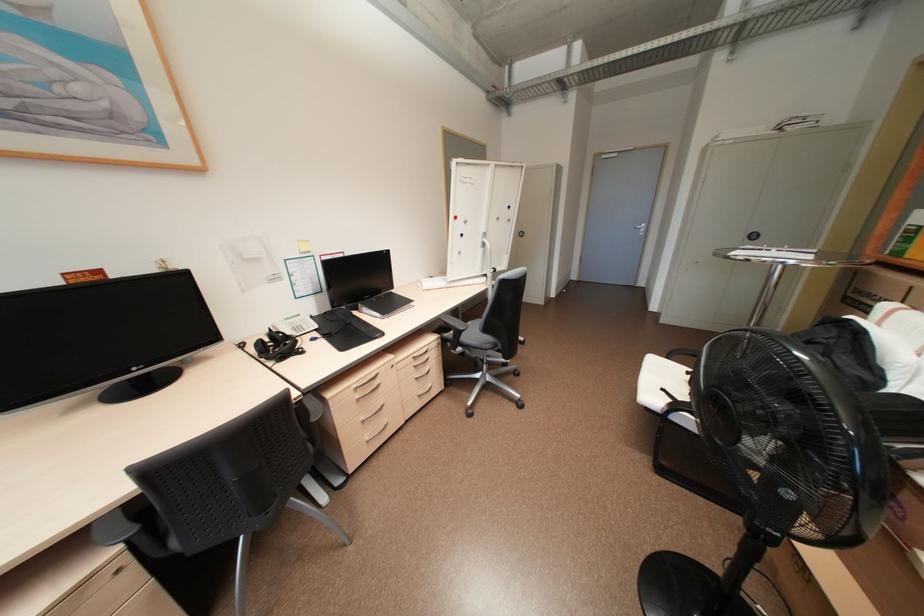
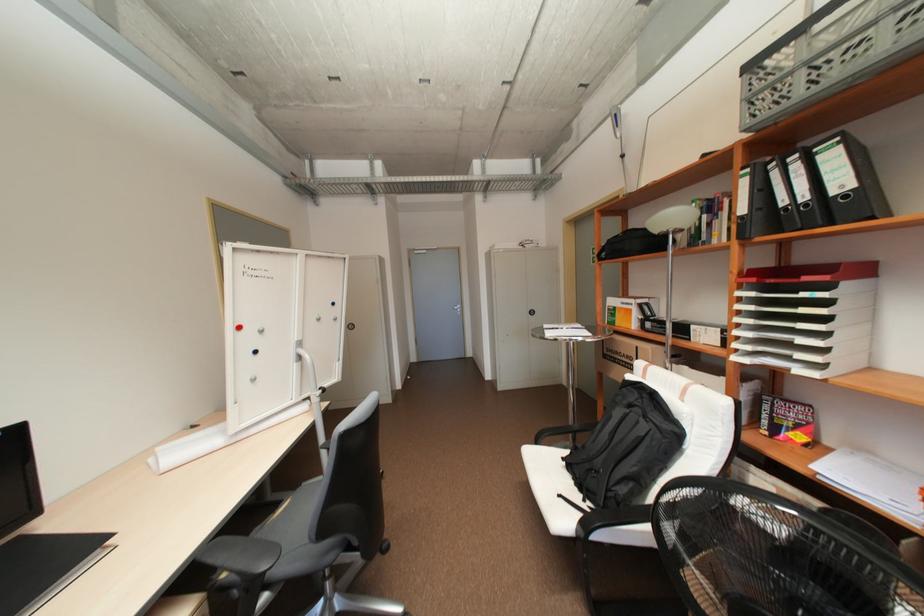
Question: The camera is either moving clockwise (left) or counter-clockwise (right) around the object. The first image is from the beginning of the video and the second image is from the end. Is the camera moving left or right when shooting the video?

Choices:
 (A) Left
 (B) Right

Answer: (A)